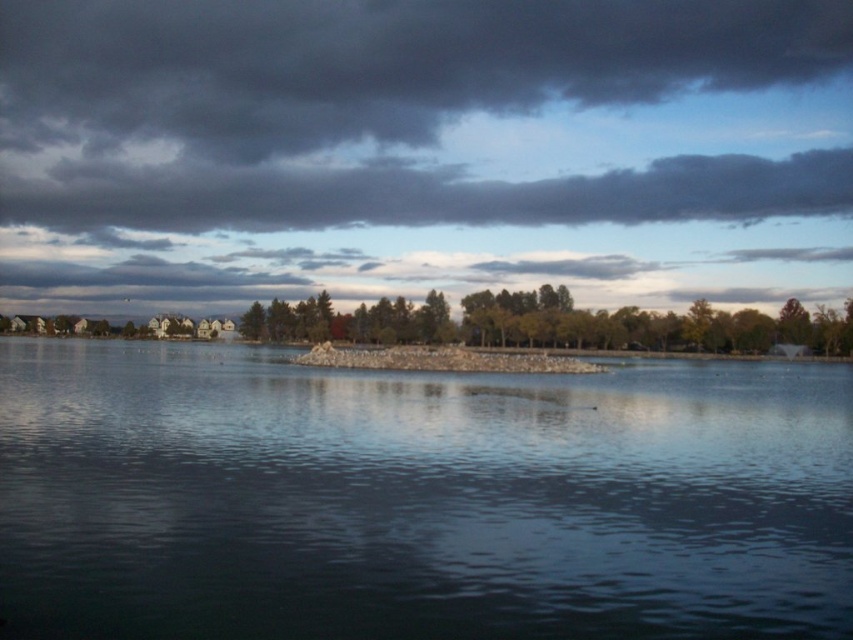
Question: Which object appears closest to the camera in this image?

Choices:
 (A) dark gray cloud at upper center
 (B) transparent water at center
 (C) green matte tree at upper right

Answer: (B)

Question: Is dark gray cloud at upper center to the right of green leafy trees at center from the viewer's perspective?

Choices:
 (A) no
 (B) yes

Answer: (A)

Question: Does transparent water at center appear on the right side of dark gray cloud at upper center?

Choices:
 (A) yes
 (B) no

Answer: (A)

Question: Which object is positioned closest to the dark gray cloud at upper center?

Choices:
 (A) green matte tree at upper right
 (B) transparent water at center

Answer: (A)

Question: Estimate the real-world distances between objects in this image. Which object is closer to the green leafy trees at center?

Choices:
 (A) transparent water at center
 (B) dark gray cloud at upper center
 (C) green matte tree at upper right

Answer: (C)

Question: Is transparent water at center positioned behind dark gray cloud at upper center?

Choices:
 (A) no
 (B) yes

Answer: (A)